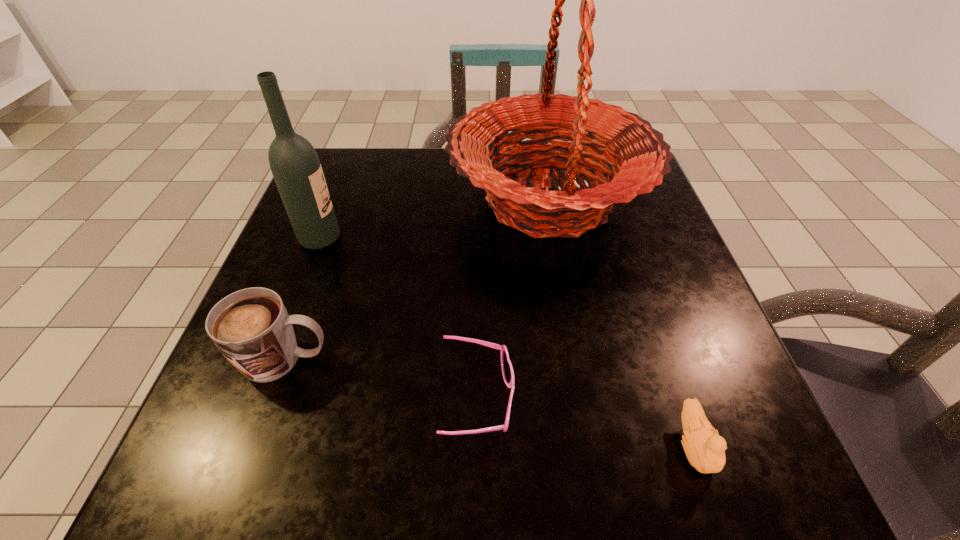
The image size is (960, 540). I want to click on duckling that is at the near edge, so click(705, 450).

At what (x,y) coordinates should I click in order to perform the action: click on sunglasses located at the near edge. Please return your answer as a coordinate pair (x, y). Looking at the image, I should click on (507, 370).

The image size is (960, 540). Identify the location of wine bottle present at the left edge. (295, 166).

Locate an element on the screen. The height and width of the screenshot is (540, 960). mug that is at the left edge is located at coordinates (251, 327).

Identify the location of basket that is at the right edge. (642, 159).

Locate an element on the screen. The height and width of the screenshot is (540, 960). duckling present at the right edge is located at coordinates (705, 450).

At what (x,y) coordinates should I click in order to perform the action: click on object that is positioned at the far right corner. Please return your answer as a coordinate pair (x, y). This screenshot has height=540, width=960. Looking at the image, I should click on (642, 159).

This screenshot has width=960, height=540. I want to click on object present at the near right corner, so click(705, 450).

Find the location of a particular element. free spot at the far edge of the desktop is located at coordinates (440, 164).

The width and height of the screenshot is (960, 540). Find the location of `vacant space at the near edge of the desktop`. vacant space at the near edge of the desktop is located at coordinates (363, 455).